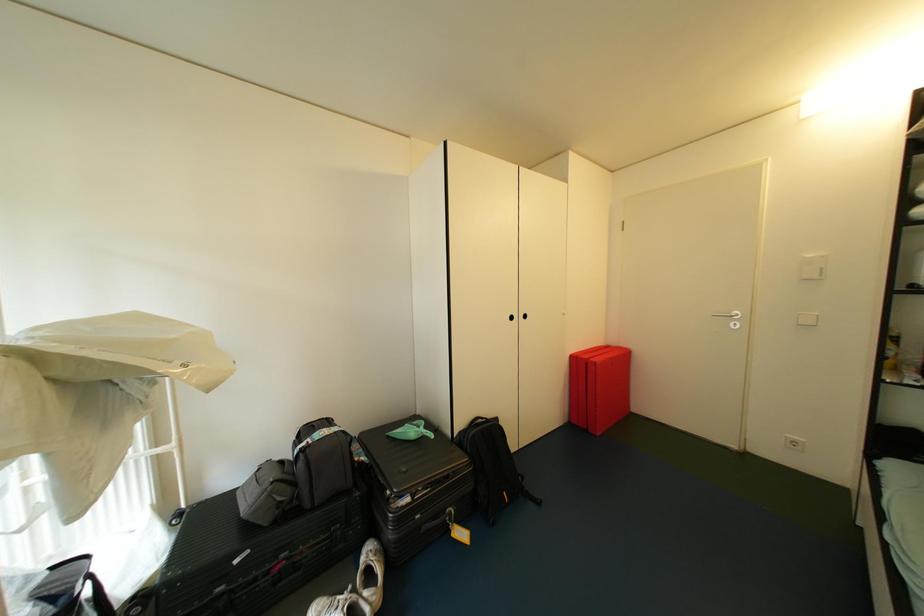
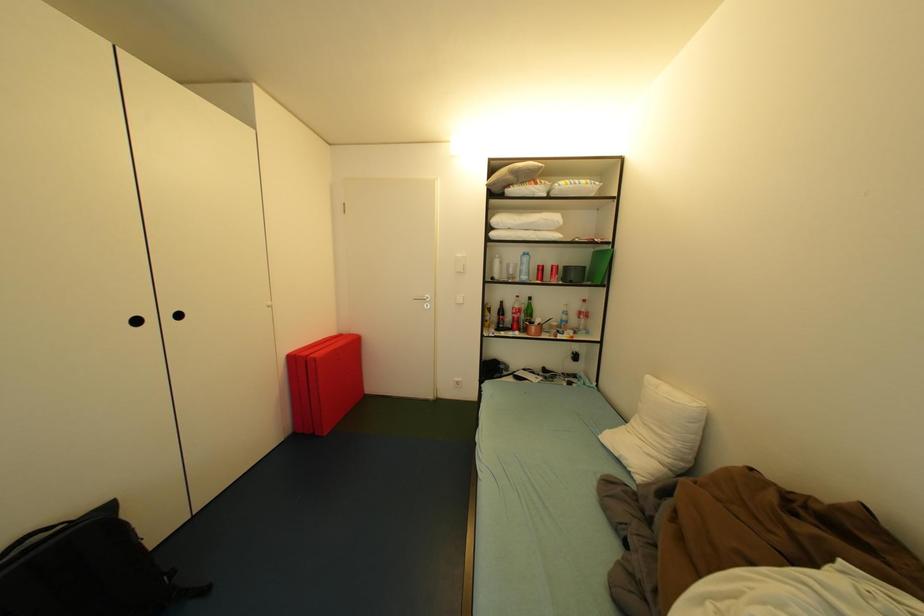
Question: How did the camera likely rotate?

Choices:
 (A) Left
 (B) Right
 (C) Up
 (D) Down

Answer: (B)